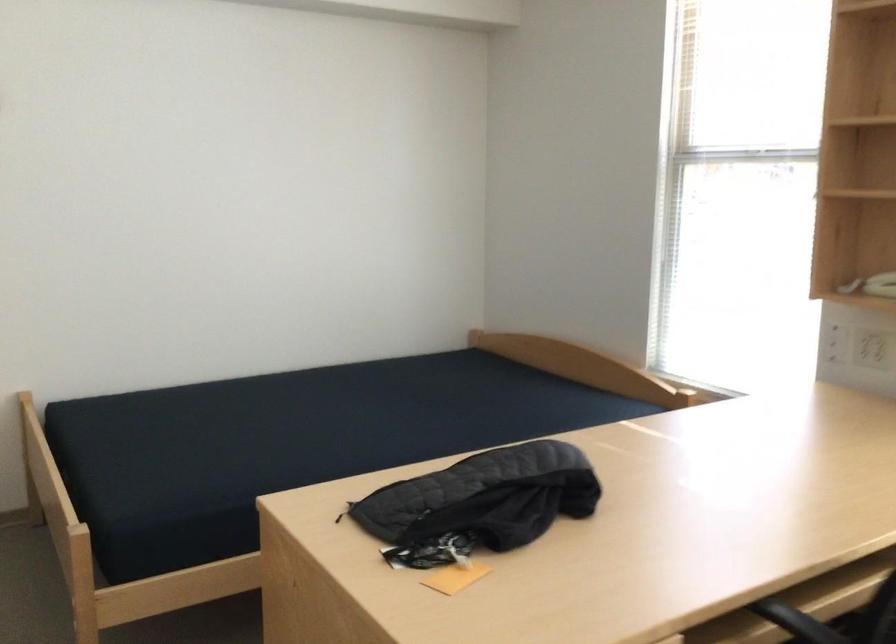
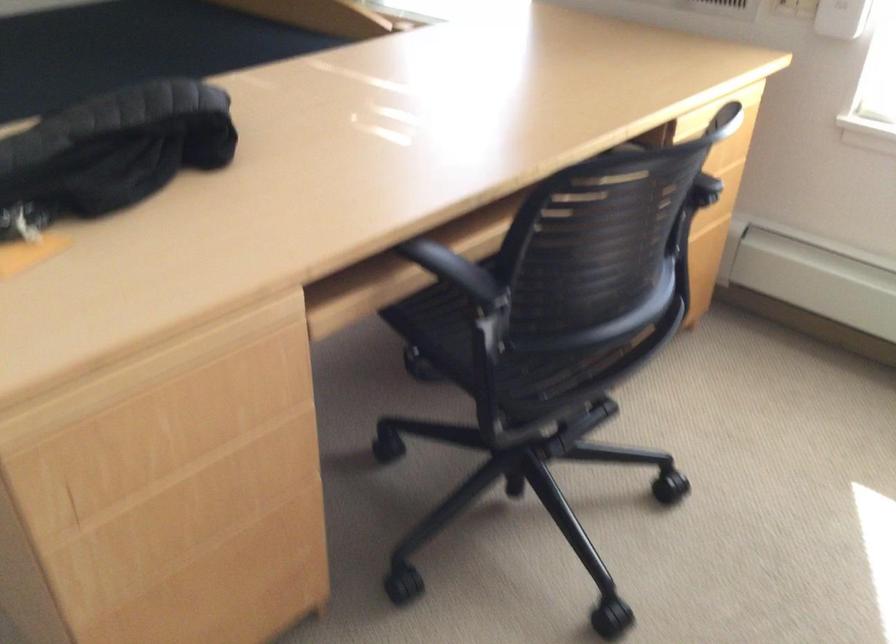
The first image is from the beginning of the video and the second image is from the end. How did the camera likely rotate when shooting the video?

The camera's rotation is toward right-down.